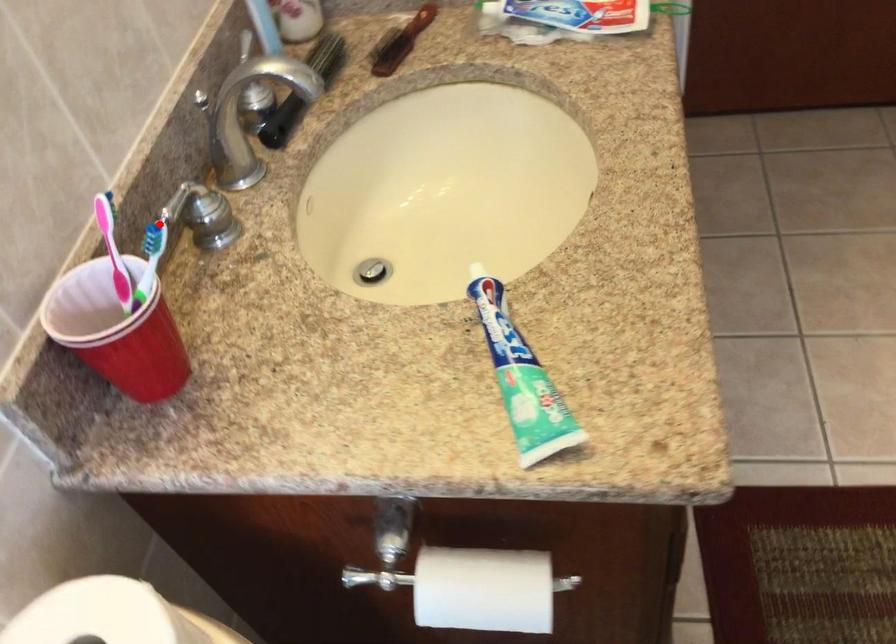
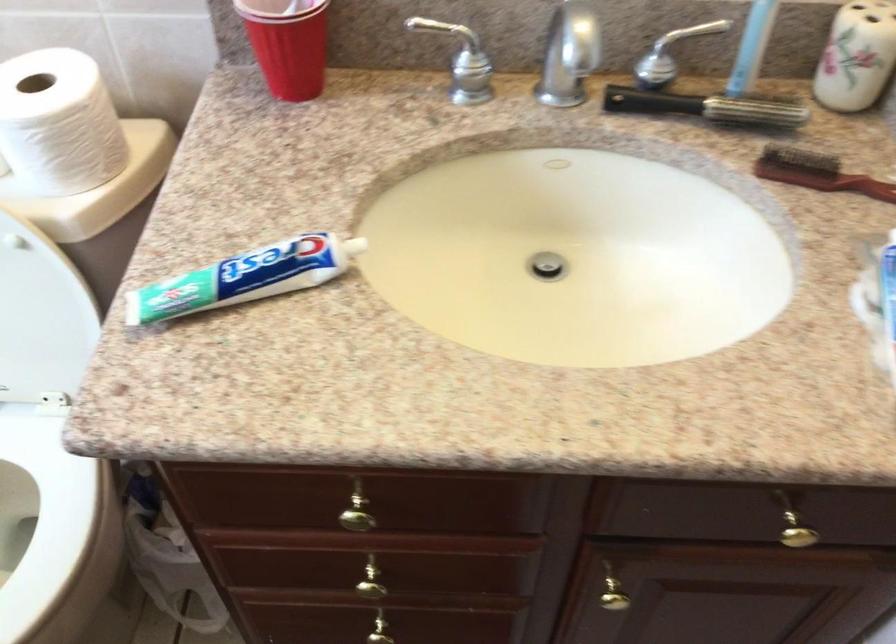
The point at the highlighted location is marked in the first image. Where is the corresponding point in the second image?

(455, 44)